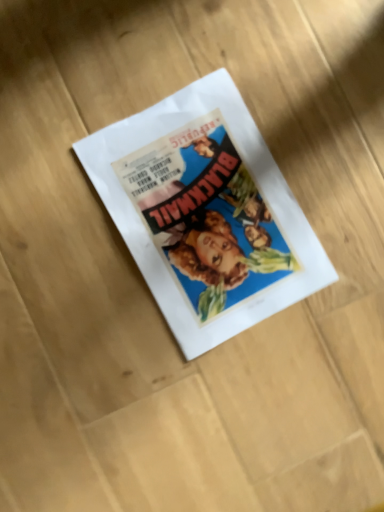
Describe the element at coordinates (205, 213) in the screenshot. I see `matte paper poster at center` at that location.

Locate an element on the screen. matte paper poster at center is located at coordinates (205, 213).

You are a GUI agent. You are given a task and a screenshot of the screen. Output one action in this format:
    pyautogui.click(x=<x>, y=<y>)
    Task: Click on the matte paper poster at center
    This screenshot has height=512, width=384.
    Given the screenshot: What is the action you would take?
    pyautogui.click(x=205, y=213)